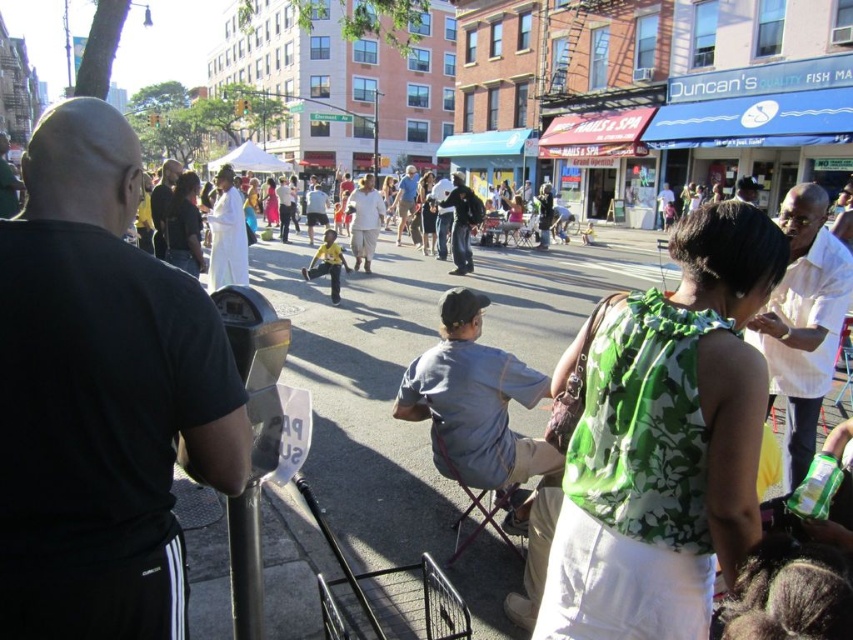
Consider the image. Which of these two, green floral blouse at center or metallic gray parking meter at lower left, stands shorter?

With less height is metallic gray parking meter at lower left.

Who is higher up, green floral blouse at center or metallic gray parking meter at lower left?

green floral blouse at center is higher up.

The image size is (853, 640). What are the coordinates of `green floral blouse at center` in the screenshot? It's located at (666, 442).

Which is in front, point (245, 307) or point (396, 237)?

Point (245, 307)

Between metallic gray parking meter at lower left and light blue shirt at center, which one appears on the right side from the viewer's perspective?

metallic gray parking meter at lower left

Between point (277, 317) and point (404, 177), which one is positioned in front?

Point (277, 317)

Where is `metallic gray parking meter at lower left`? This screenshot has width=853, height=640. metallic gray parking meter at lower left is located at coordinates (254, 440).

Measure the distance between white shirt at right and camera.

The distance of white shirt at right from camera is 12.14 feet.

Does white shirt at right appear under light blue shirt at center?

Yes, white shirt at right is below light blue shirt at center.

Does point (804, 275) come closer to viewer compared to point (410, 186)?

That is True.

Where is `white shirt at right`? This screenshot has width=853, height=640. white shirt at right is located at coordinates (804, 321).